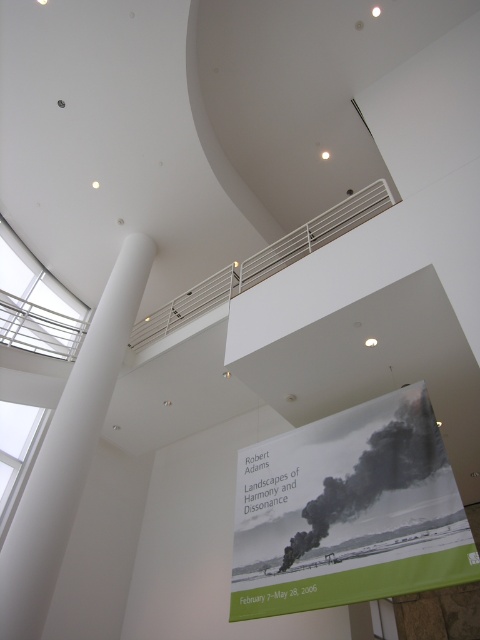
Who is more distant from viewer, (291,596) or (21,632)?

The point (21,632) is behind.

Between green matte poster at lower center and white smooth column at center, which one is positioned lower?

green matte poster at lower center

Where is `green matte poster at lower center`? green matte poster at lower center is located at coordinates (348, 512).

The width and height of the screenshot is (480, 640). What are the coordinates of `green matte poster at lower center` in the screenshot? It's located at (348, 512).

Can you confirm if green matte poster at lower center is positioned below white metal rail at upper center?

Yes, green matte poster at lower center is below white metal rail at upper center.

Where is `green matte poster at lower center`? The height and width of the screenshot is (640, 480). green matte poster at lower center is located at coordinates (348, 512).

Locate an element on the screen. The width and height of the screenshot is (480, 640). green matte poster at lower center is located at coordinates (348, 512).

Describe the element at coordinates (69, 451) in the screenshot. I see `white smooth column at center` at that location.

Consider the image. Who is more distant from viewer, (x=94, y=371) or (x=345, y=228)?

Positioned behind is point (x=345, y=228).

Is point (33, 588) positioned after point (143, 330)?

No, (33, 588) is in front of (143, 330).

This screenshot has height=640, width=480. I want to click on white smooth column at center, so click(69, 451).